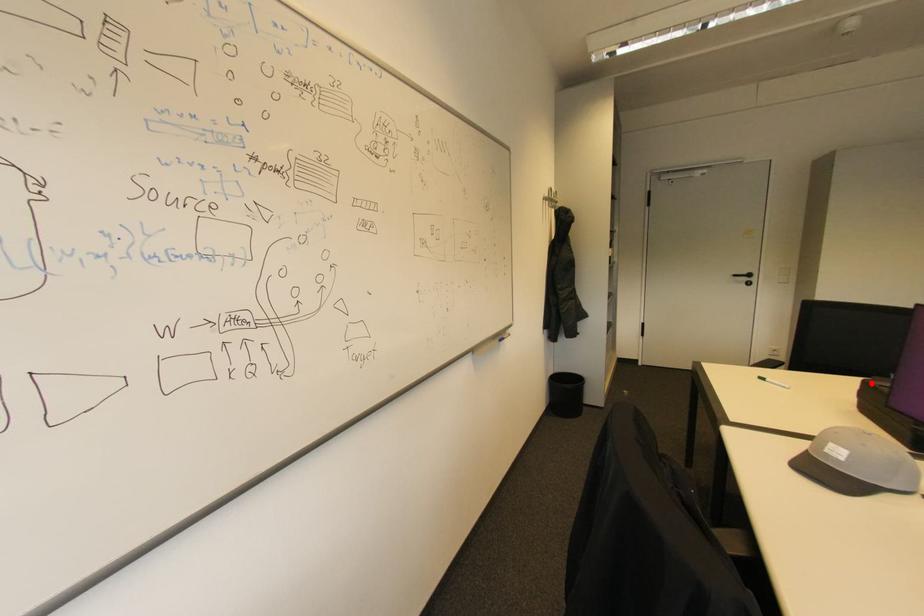
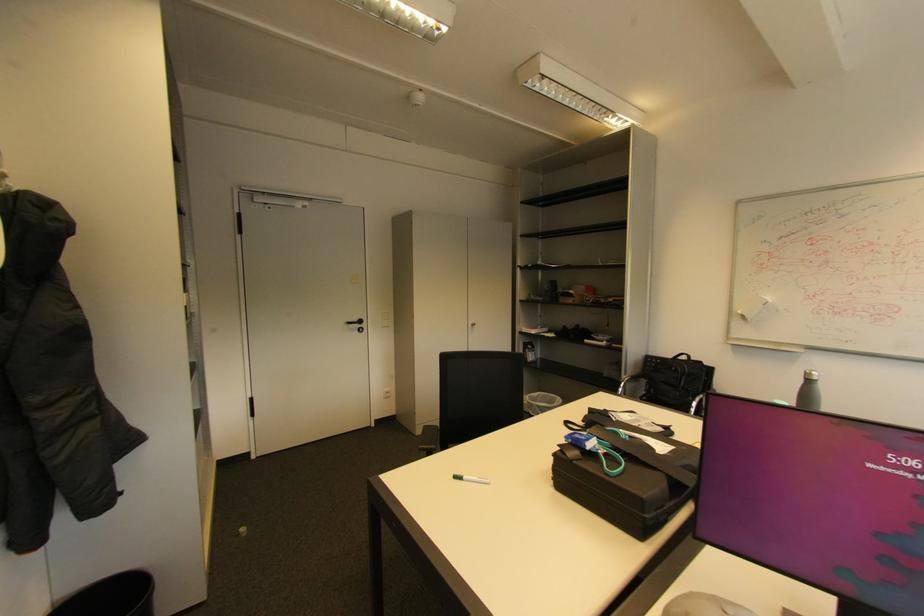
The point at the highlighted location is marked in the first image. Where is the corresponding point in the second image?

(561, 456)